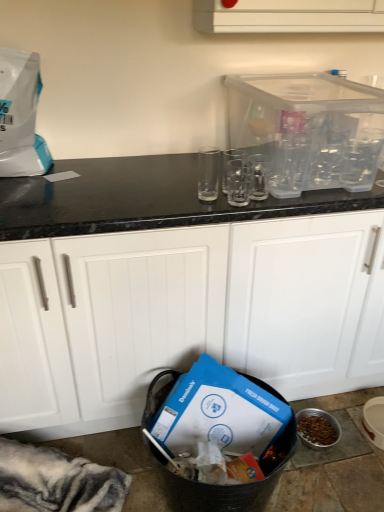
Question: Is white matte cabinet at center bigger than clear glass at center, positioned as the second clear in right-to-left order?

Choices:
 (A) no
 (B) yes

Answer: (B)

Question: Is white matte cabinet at center turned away from clear glass at center, which ranks as the 2th clear in left-to-right order?

Choices:
 (A) no
 (B) yes

Answer: (A)

Question: From a real-world perspective, is white matte cabinet at center over clear glass at center, positioned as the second clear in right-to-left order?

Choices:
 (A) yes
 (B) no

Answer: (B)

Question: Is white matte cabinet at center positioned beyond the bounds of clear glass at center, positioned as the second clear in right-to-left order?

Choices:
 (A) yes
 (B) no

Answer: (A)

Question: Is the depth of white matte cabinet at center less than that of clear glass at center, which ranks as the 2th clear in left-to-right order?

Choices:
 (A) no
 (B) yes

Answer: (B)

Question: Does white matte cabinet at center appear on the left side of clear glass at center, which ranks as the 2th clear in left-to-right order?

Choices:
 (A) no
 (B) yes

Answer: (B)

Question: Is transparent glass at center, which is the first clear in left-to-right order, turned away from clear glass at center, which ranks as the 3th clear in left-to-right order?

Choices:
 (A) no
 (B) yes

Answer: (A)

Question: Does transparent glass at center, which is the first clear in left-to-right order, have a greater height compared to clear glass at center, marked as the 1th clear in a right-to-left arrangement?

Choices:
 (A) yes
 (B) no

Answer: (A)

Question: Can you confirm if transparent glass at center, which is the first clear in left-to-right order, is smaller than clear glass at center, which ranks as the 3th clear in left-to-right order?

Choices:
 (A) yes
 (B) no

Answer: (B)

Question: Considering the relative sizes of transparent glass at center, acting as the 3th clear starting from the right, and clear glass at center, marked as the 1th clear in a right-to-left arrangement, in the image provided, is transparent glass at center, acting as the 3th clear starting from the right, shorter than clear glass at center, marked as the 1th clear in a right-to-left arrangement,?

Choices:
 (A) yes
 (B) no

Answer: (B)

Question: Considering the relative sizes of transparent glass at center, which is the first clear in left-to-right order, and clear glass at center, marked as the 1th clear in a right-to-left arrangement, in the image provided, is transparent glass at center, which is the first clear in left-to-right order, bigger than clear glass at center, marked as the 1th clear in a right-to-left arrangement,?

Choices:
 (A) no
 (B) yes

Answer: (B)

Question: Is transparent glass at center, which is the first clear in left-to-right order, located outside clear glass at center, which ranks as the 3th clear in left-to-right order?

Choices:
 (A) no
 (B) yes

Answer: (B)

Question: Is white matte cabinet at center oriented away from transparent plastic container at upper right?

Choices:
 (A) no
 (B) yes

Answer: (A)